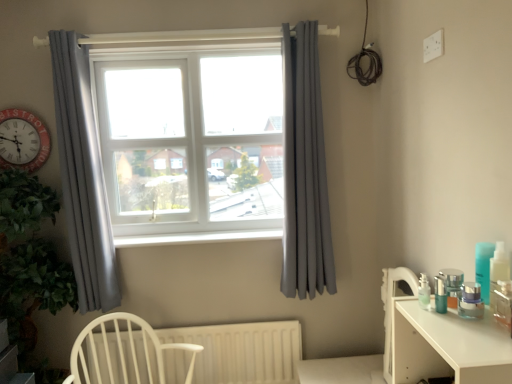
Question: From a real-world perspective, is white plastic window sill at center positioned above or below white wood chair at lower left?

Choices:
 (A) above
 (B) below

Answer: (A)

Question: Considering their positions, is white plastic window sill at center located in front of or behind white wood chair at lower left?

Choices:
 (A) front
 (B) behind

Answer: (B)

Question: Which object is the closest to the green leafy plant at left?

Choices:
 (A) white plastic window frame at center
 (B) gray fabric curtain at upper left, which ranks as the 2th curtain in right-to-left order
 (C) white matte radiator at lower center
 (D) white wood chair at lower left
 (E) gray fabric curtain at right, which is counted as the first curtain, starting from the right

Answer: (B)

Question: Considering the real-world distances, which object is farthest from the white plastic window sill at center?

Choices:
 (A) gray fabric curtain at upper left, the 1th curtain from the left
 (B) white wood chair at lower left
 (C) white matte drawer at lower right
 (D) gray fabric curtain at right, the second curtain from the left
 (E) white plastic window frame at center

Answer: (C)